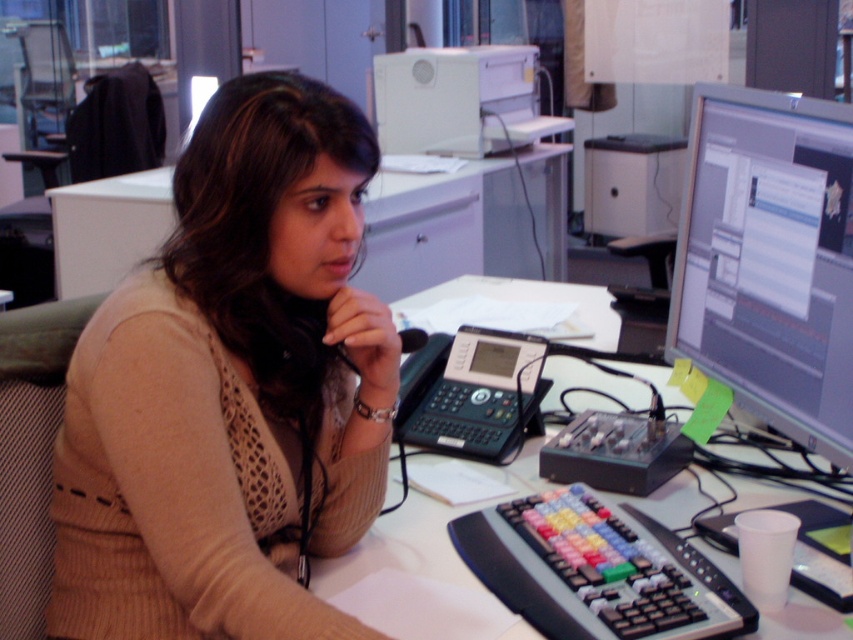
Question: In this image, where is matte gray monitor at right located relative to white plastic printer at upper center?

Choices:
 (A) below
 (B) above

Answer: (A)

Question: Among these objects, which one is nearest to the camera?

Choices:
 (A) black plastic telephone at center
 (B) white glossy table at upper center
 (C) beige knitted sweater at center

Answer: (C)

Question: Which of the following is the closest to the observer?

Choices:
 (A) (486, 356)
 (B) (402, 60)
 (C) (780, 220)
 (D) (509, 634)

Answer: (D)

Question: Which of the following is the closest to the observer?

Choices:
 (A) (672, 593)
 (B) (442, 148)

Answer: (A)

Question: Is matte gray monitor at right smaller than black plastic telephone at center?

Choices:
 (A) no
 (B) yes

Answer: (A)

Question: Is white glossy table at upper center above black plastic telephone at center?

Choices:
 (A) yes
 (B) no

Answer: (A)